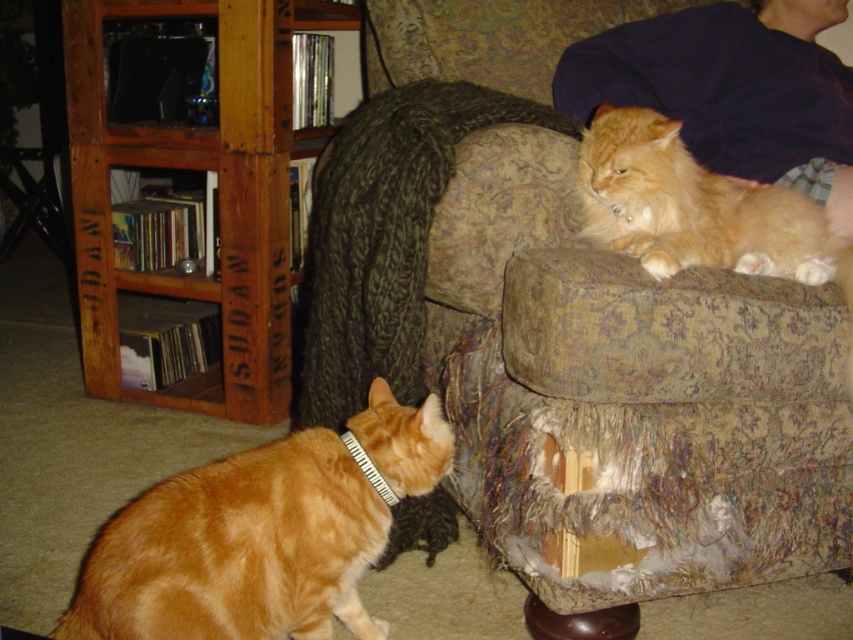
Question: Is orange fur cat at upper right to the right of black fabric neckband at lower left from the viewer's perspective?

Choices:
 (A) yes
 (B) no

Answer: (A)

Question: Considering the relative positions of patterned fabric couch at upper center and orange fur cat at upper right in the image provided, where is patterned fabric couch at upper center located with respect to orange fur cat at upper right?

Choices:
 (A) above
 (B) below

Answer: (B)

Question: Which point appears closest to the camera in this image?

Choices:
 (A) (190, 634)
 (B) (357, 451)

Answer: (A)

Question: Which point is closer to the camera?

Choices:
 (A) (144, 625)
 (B) (465, 17)

Answer: (A)

Question: Does patterned fabric couch at upper center have a larger size compared to orange fur cat at upper right?

Choices:
 (A) yes
 (B) no

Answer: (A)

Question: Among these points, which one is nearest to the camera?

Choices:
 (A) (341, 548)
 (B) (811, 246)

Answer: (A)